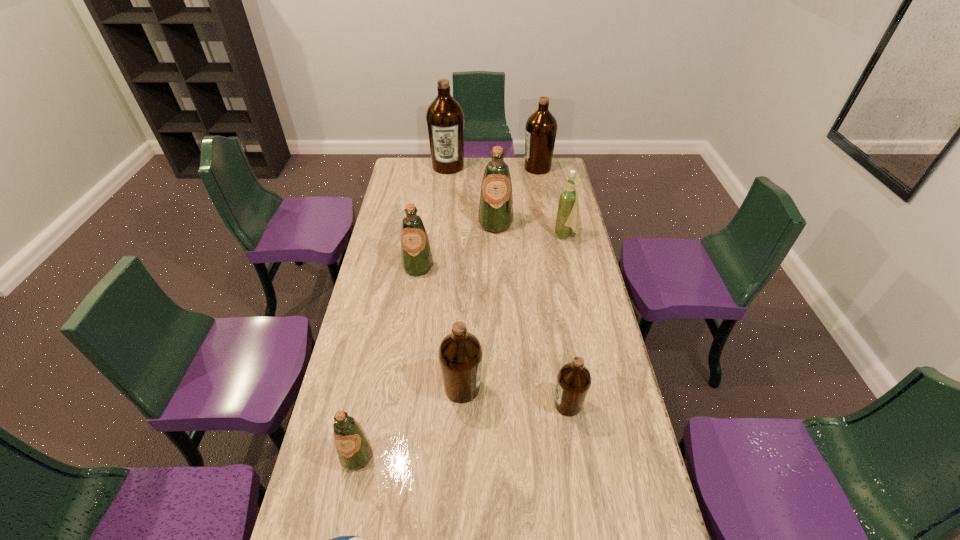
This screenshot has width=960, height=540. Find the location of `the smallest green olive oil`. the smallest green olive oil is located at coordinates (354, 449).

You are a GUI agent. You are given a task and a screenshot of the screen. Output one action in this format:
    pyautogui.click(x=<x>, y=<y>)
    Task: Click on the nearest olive oil
    The height and width of the screenshot is (540, 960).
    Given the screenshot: What is the action you would take?
    pyautogui.click(x=354, y=449)

This screenshot has height=540, width=960. In order to click on free location located 0.210m on the label of the tallest olive oil in this screenshot , I will do `click(444, 199)`.

At what (x,y) coordinates should I click in order to perform the action: click on vacant space located on the label of the third smallest brown olive oil. Please return your answer as a coordinate pair (x, y). The image size is (960, 540). Looking at the image, I should click on (477, 168).

Find the location of a particular element. The height and width of the screenshot is (540, 960). vacant space located on the label of the third smallest brown olive oil is located at coordinates (471, 168).

Identify the location of free point located on the label of the third smallest brown olive oil. (465, 168).

In order to click on blank space located on the front-facing side of the fifth nearest olive oil in this screenshot , I will do `click(498, 288)`.

Where is `free region located 0.140m on the front-facing side of the wine bottle`? The image size is (960, 540). free region located 0.140m on the front-facing side of the wine bottle is located at coordinates (522, 236).

Where is `free region located on the front-facing side of the wine bottle`? free region located on the front-facing side of the wine bottle is located at coordinates (513, 236).

This screenshot has width=960, height=540. What are the coordinates of `free space located on the front-facing side of the wine bottle` in the screenshot? It's located at (533, 236).